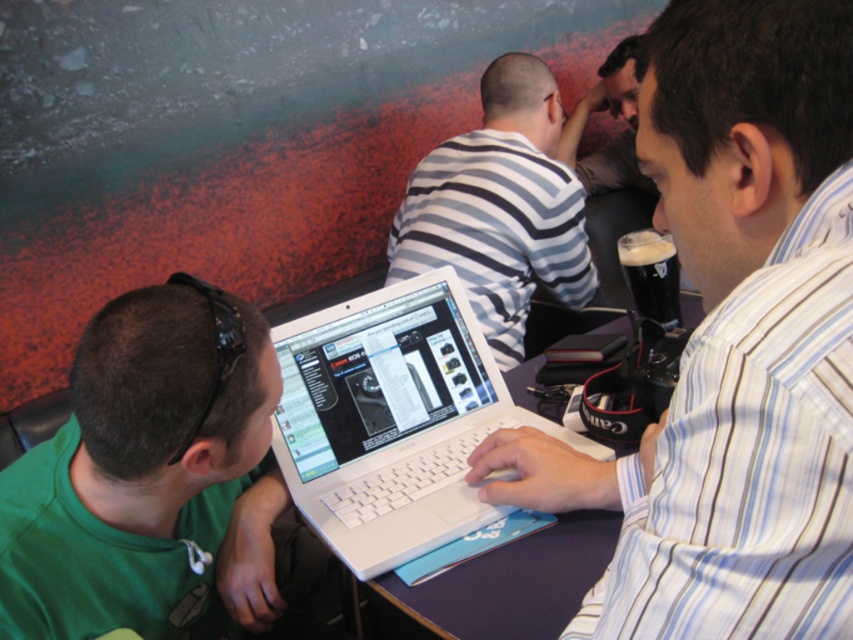
Which is behind, point (479, 364) or point (463, 273)?

The point (463, 273) is behind.

Who is positioned more to the left, white plastic laptop at center or striped cotton shirt at center?

Positioned to the left is white plastic laptop at center.

Where is `white plastic laptop at center`? This screenshot has width=853, height=640. white plastic laptop at center is located at coordinates (392, 420).

At what (x,y) coordinates should I click in order to perform the action: click on white plastic laptop at center. Please return your answer as a coordinate pair (x, y). Looking at the image, I should click on (392, 420).

Is point (154, 380) positioned behind point (521, 150)?

No, (154, 380) is in front of (521, 150).

What do you see at coordinates (149, 481) in the screenshot?
I see `green matte shirt at lower left` at bounding box center [149, 481].

Between point (39, 577) and point (554, 227), which one is positioned in front?

Point (39, 577) is in front.

What are the coordinates of `green matte shirt at lower left` in the screenshot? It's located at (149, 481).

Between white glossy laptop at center and white plastic laptop at center, which one appears on the left side from the viewer's perspective?

From the viewer's perspective, white plastic laptop at center appears more on the left side.

Between white glossy laptop at center and white plastic laptop at center, which one is positioned higher?

Positioned higher is white glossy laptop at center.

The height and width of the screenshot is (640, 853). What do you see at coordinates (734, 344) in the screenshot? I see `white glossy laptop at center` at bounding box center [734, 344].

The image size is (853, 640). Identify the location of white glossy laptop at center. (734, 344).